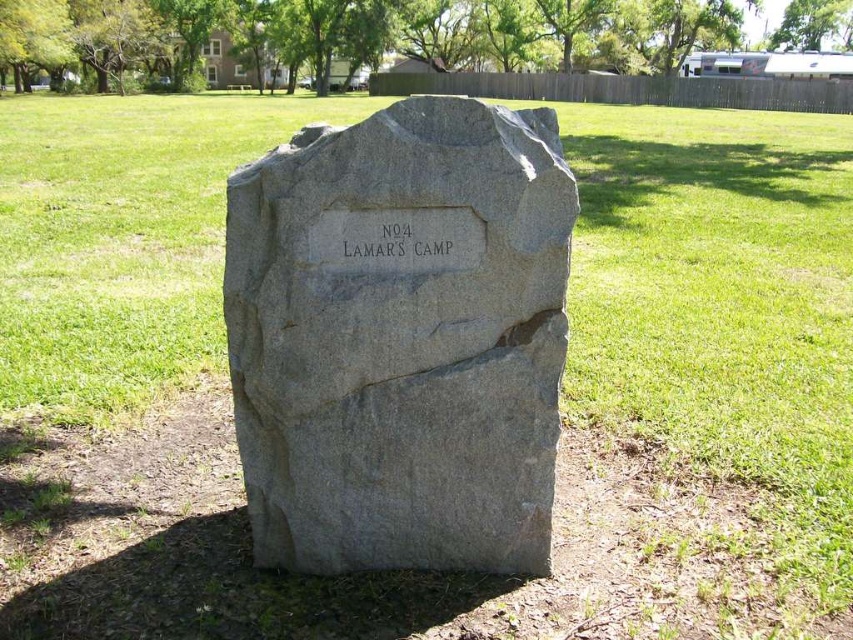
You are a park maintenance worker checking the condition of the gray stone marker at center and the black stone engraving at center. Which object requires more space to move around it?

The gray stone marker at center is larger in size than the black stone engraving at center, so you would need more space to move around the gray stone marker at center.

You are standing in a park and see the gray stone marker at center and the black stone engraving at center. Which one is positioned lower?

The gray stone marker at center is positioned lower than the black stone engraving at center.

You are planning to place a small decorative rock next to both the gray stone marker at center and the black stone engraving at center. To ensure symmetry, you need to know which one has a larger width. Can you determine which is wider?

The gray stone marker at center might be wider than black stone engraving at center according to the description, so it is likely the gray stone marker at center is wider.